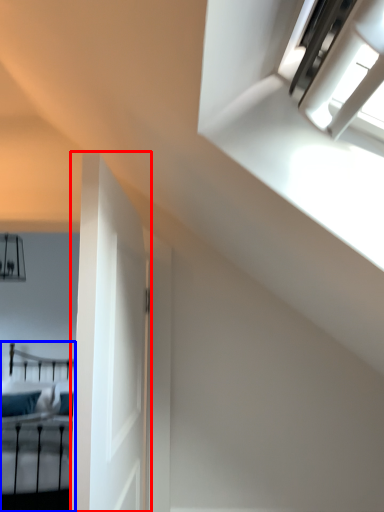
Question: Among these objects, which one is nearest to the camera, door (highlighted by a red box) or bed (highlighted by a blue box)?

Choices:
 (A) door
 (B) bed

Answer: (A)